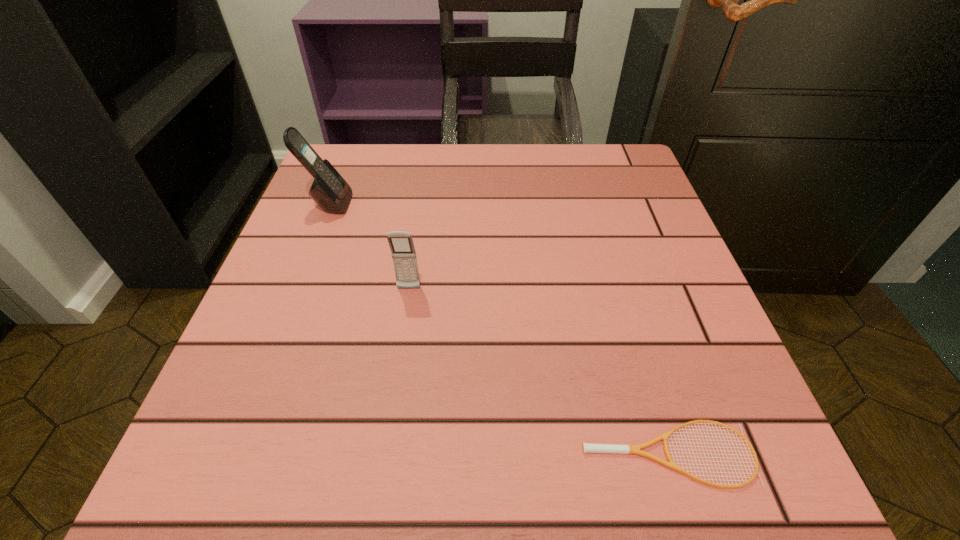
Find the location of a particular element. The image size is (960, 540). the leftmost object is located at coordinates (329, 190).

This screenshot has height=540, width=960. In order to click on the farthest object in this screenshot , I will do `click(329, 190)`.

You are a GUI agent. You are given a task and a screenshot of the screen. Output one action in this format:
    pyautogui.click(x=<x>, y=<y>)
    Task: Click on the second tallest object
    This screenshot has width=960, height=540.
    Given the screenshot: What is the action you would take?
    pyautogui.click(x=401, y=244)

I want to click on the shorter cellular telephone, so click(x=401, y=244).

Where is `tennis racket`? Image resolution: width=960 pixels, height=540 pixels. tennis racket is located at coordinates (586, 447).

What are the coordinates of `the shortest object` in the screenshot? It's located at (586, 447).

I want to click on vacant area situated on the front-facing side of the taller cellular telephone, so click(397, 204).

Where is `free space located 0.100m on the front-facing side of the right cellular telephone`? free space located 0.100m on the front-facing side of the right cellular telephone is located at coordinates (401, 340).

Identify the location of vacant space located 0.170m on the left of the tennis racket. (448, 454).

Locate an element on the screen. This screenshot has width=960, height=540. object at the far edge is located at coordinates (329, 190).